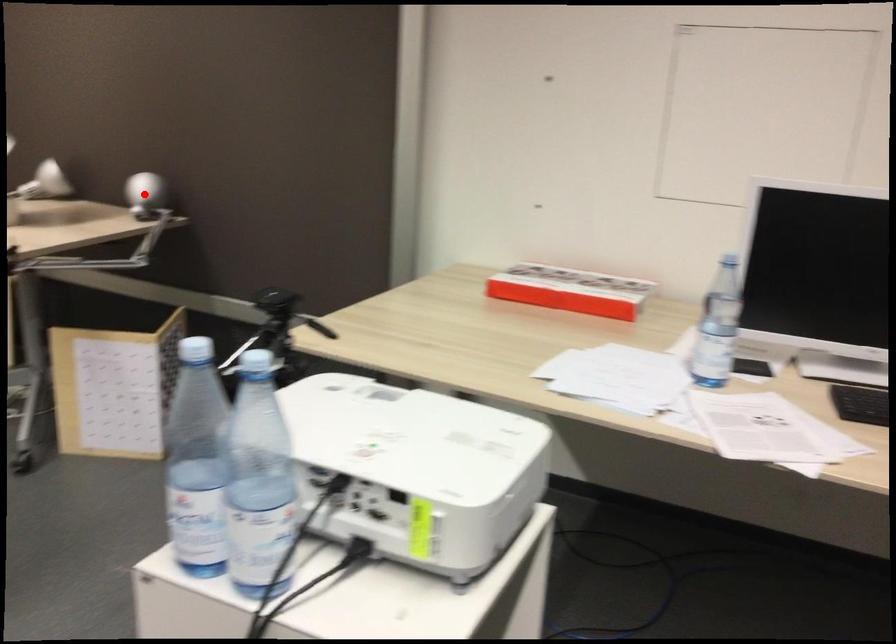
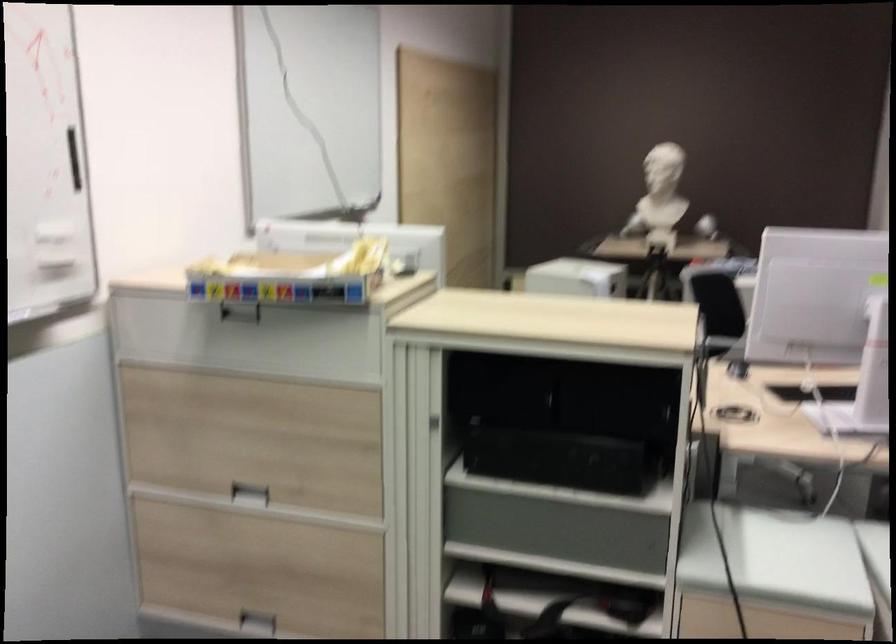
Question: I am providing you with two images of the same scene from different viewpoints. A red point is marked on the first image. Is the red point's position out of view in image 2?

Choices:
 (A) Yes
 (B) No

Answer: (A)